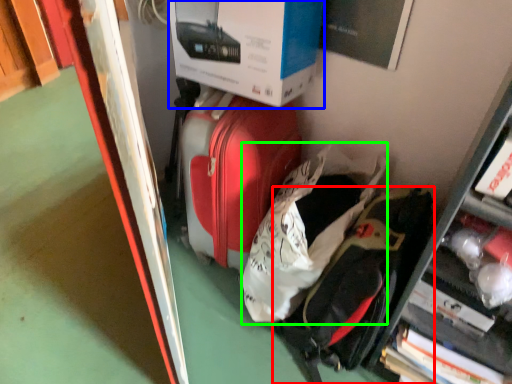
Question: Which is farther away from backpack (highlighted by a red box)? box (highlighted by a blue box) or luggage (highlighted by a green box)?

Choices:
 (A) box
 (B) luggage

Answer: (A)